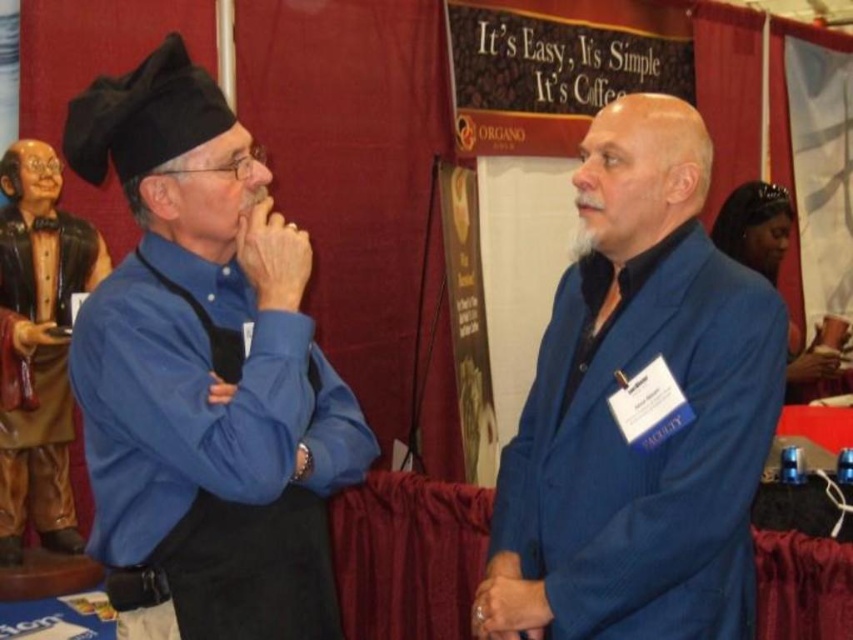
You are standing in front of the convention backdrop. There is a matte black hat at left and a blue blazer on the right. Which object is closer to the center of the backdrop?

The matte black hat at left is closer to the center of the backdrop because its coordinates are at point [204,376], which places it nearer to the center compared to the blue blazer on the right.

In the scene shown: Based on the scene description, which object is larger in size between the matte black hat at left and the brown leather robe at left?

The matte black hat at left is bigger than the brown leather robe at left according to the description.

You are a photographer standing in front of the two men in the scene. You want to take a photo that includes both the matte black hat at left and the brown leather robe at left. What is the minimum distance you should position yourself from the nearest object to ensure both are in frame?

The minimum distance you should position yourself is 3.53 feet from the matte black hat at left to ensure both it and the brown leather robe at left are in frame, as they are 3.53 feet apart.